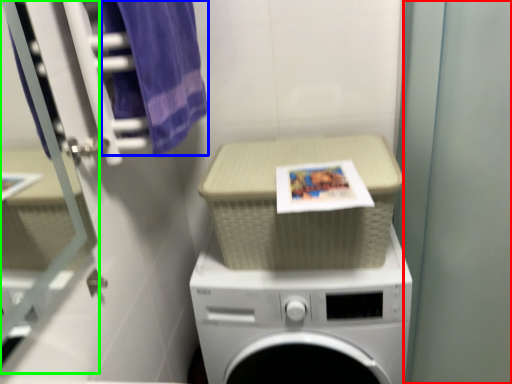
Question: Which object is positioned farthest from screen door (highlighted by a red box)? Select from bath towel (highlighted by a blue box) and glass door (highlighted by a green box).

Choices:
 (A) bath towel
 (B) glass door

Answer: (B)